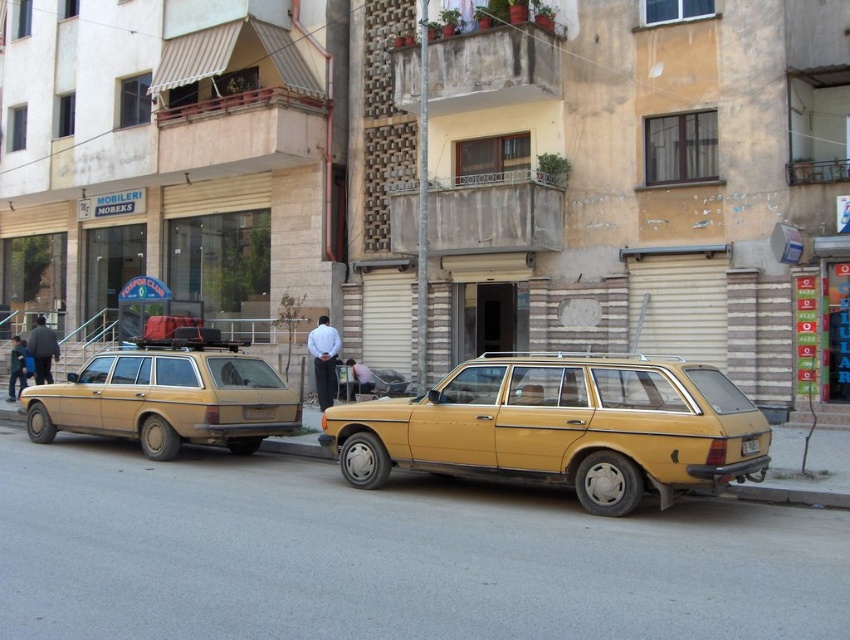
Which is below, yellow matte station wagon at center or dark blue jeans at lower left?

yellow matte station wagon at center

Can you confirm if yellow matte station wagon at center is positioned to the left of dark blue jeans at lower left?

Incorrect, yellow matte station wagon at center is not on the left side of dark blue jeans at lower left.

Find the location of `yellow matte station wagon at center`. yellow matte station wagon at center is located at coordinates (561, 426).

Find the location of a particular element. yellow matte station wagon at center is located at coordinates (561, 426).

How far apart are white shirt at center and dark gray pants at left?

white shirt at center is 22.64 feet away from dark gray pants at left.

Between white shirt at center and dark gray pants at left, which one has less height?

dark gray pants at left

Which is behind, point (333, 372) or point (44, 326)?

Point (44, 326)

I want to click on white shirt at center, so click(324, 358).

Does point (26, 371) come in front of point (374, 381)?

That is False.

Is point (14, 344) farther from camera compared to point (360, 371)?

Yes, point (14, 344) is farther from viewer.

Does point (18, 339) come closer to viewer compared to point (354, 376)?

No, it is behind (354, 376).

Where is `dark blue jeans at lower left`? dark blue jeans at lower left is located at coordinates (17, 368).